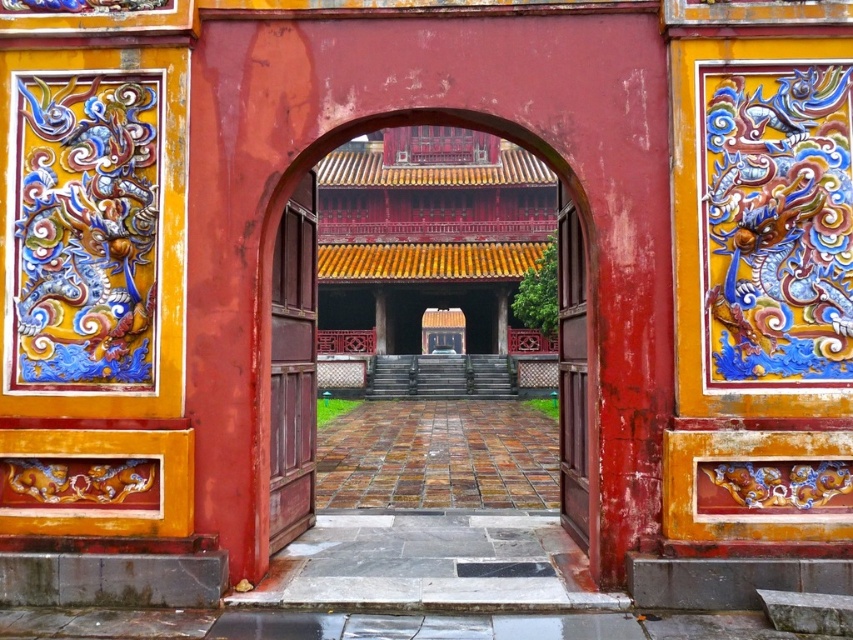
You are standing in front of the archway and want to enter through the doors. Which door should you open first, the wooden door at center or the smooth wood door at center?

The wooden door at center is located above the smooth wood door at center, so you should open the smooth wood door at center first as it is lower and accessible.

You are a visitor approaching the archway and want to enter the building behind it. There are two doors here, the polished wood door at center and the wooden door at center. Which door should you open to reach the building?

You should open the wooden door at center because the polished wood door at center is in front of it, blocking access.